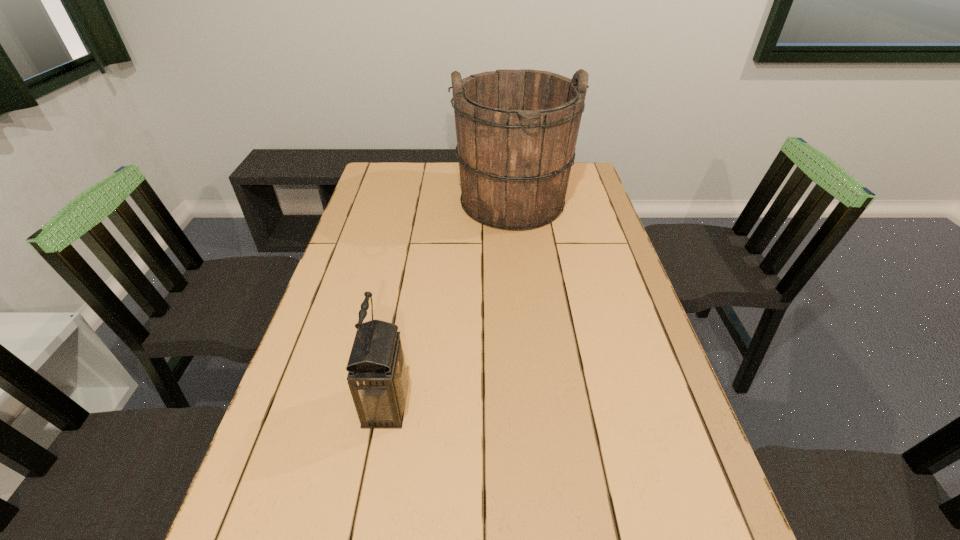
In the image, there is a desktop. Find the location of `vacant space at the left edge`. vacant space at the left edge is located at coordinates (343, 328).

Where is `vacant area at the right edge`? The height and width of the screenshot is (540, 960). vacant area at the right edge is located at coordinates (602, 239).

Locate an element on the screen. vacant area that lies between the right object and the shorter object is located at coordinates (449, 305).

At what (x,y) coordinates should I click in order to perform the action: click on vacant space in between the shorter object and the bucket. Please return your answer as a coordinate pair (x, y). The image size is (960, 540). Looking at the image, I should click on (449, 305).

What are the coordinates of `free space between the shorter object and the right object` in the screenshot? It's located at (449, 305).

I want to click on free space between the right object and the lantern, so click(449, 305).

This screenshot has width=960, height=540. Identify the location of vacant space that satisfies the following two spatial constraints: 1. on the front side of the taller object; 2. on the front-facing side of the shorter object. (533, 404).

This screenshot has height=540, width=960. Identify the location of vacant space that satisfies the following two spatial constraints: 1. on the front side of the taller object; 2. on the front-facing side of the lantern. (533, 404).